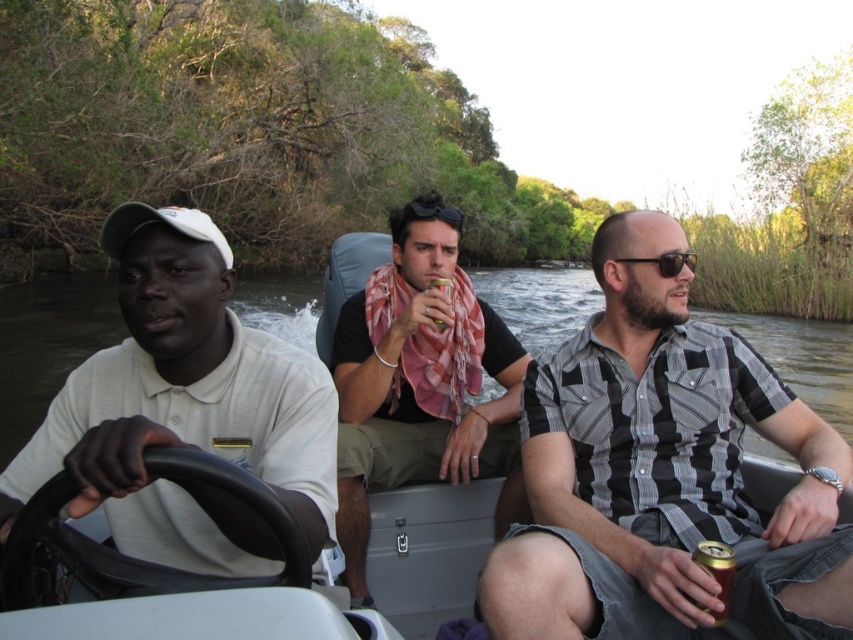
Between checkered fabric shirt at center and smooth plastic boat at center, which one appears on the left side from the viewer's perspective?

smooth plastic boat at center

Does checkered fabric shirt at center appear under smooth plastic boat at center?

Indeed, checkered fabric shirt at center is positioned under smooth plastic boat at center.

What are the coordinates of `checkered fabric shirt at center` in the screenshot? It's located at (663, 476).

Which is behind, point (769, 397) or point (680, 252)?

Positioned behind is point (680, 252).

Who is higher up, checkered fabric shirt at center or sunglasses at center?

Positioned higher is sunglasses at center.

Find the location of a particular element. This screenshot has height=640, width=853. checkered fabric shirt at center is located at coordinates (663, 476).

Image resolution: width=853 pixels, height=640 pixels. What are the coordinates of `checkered fabric shirt at center` in the screenshot? It's located at (663, 476).

In the scene shown: Is white matte shirt at left further to the viewer compared to gold metallic can at lower right?

No, white matte shirt at left is in front of gold metallic can at lower right.

Is point (198, 220) positioned behind point (722, 600)?

Yes, it is behind point (722, 600).

Locate an element on the screen. Image resolution: width=853 pixels, height=640 pixels. white matte shirt at left is located at coordinates (184, 410).